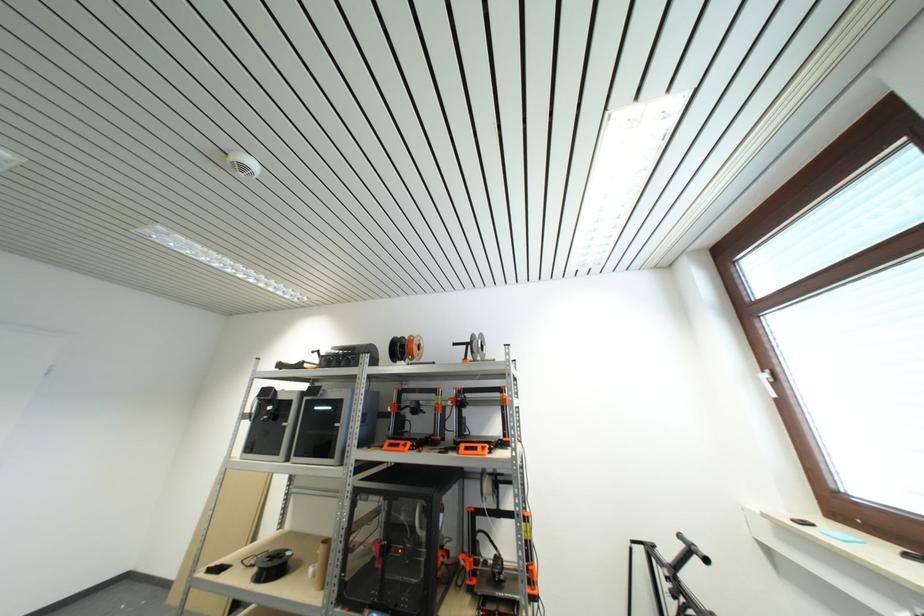
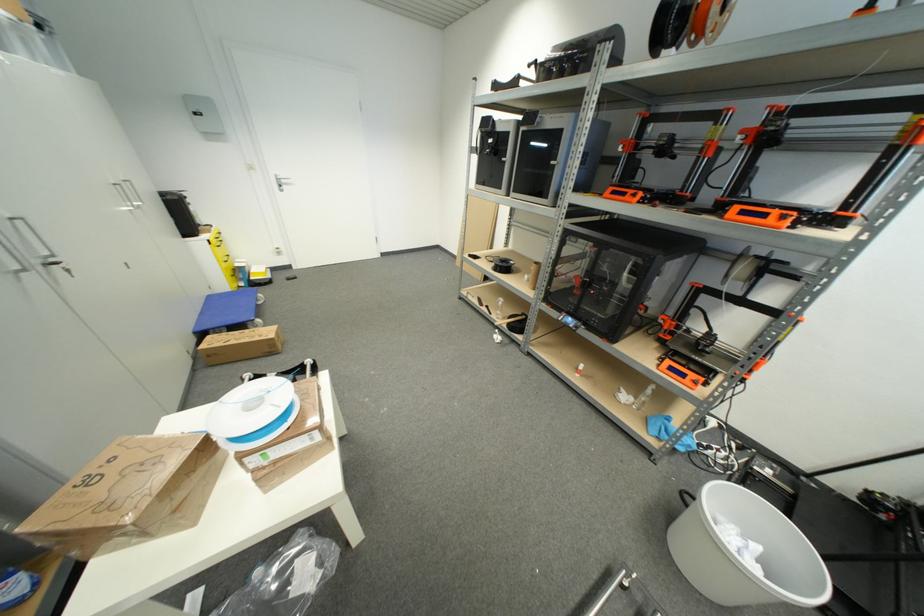
The first image is from the beginning of the video and the second image is from the end. How did the camera likely rotate when shooting the video?

The camera rotated toward left-down.